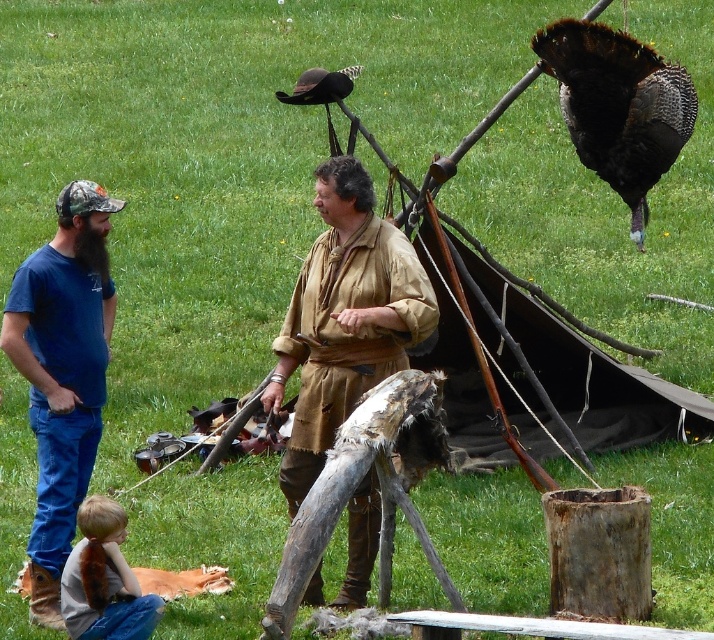
You are an observer looking at the scene. Which object, the brown leather shirt at center or the shiny black turkey at upper right, occupies more horizontal space in the image?

The shiny black turkey at upper right occupies more horizontal space because the brown leather shirt at center has a lesser width compared to it.

You are a photographer trying to capture a clear photo of the shiny black turkey at upper right. However, the blue denim jeans at left are blocking part of your view. Based on their sizes, which object should you move closer to the camera to ensure the turkey is fully visible?

The blue denim jeans at left is smaller in size compared to the shiny black turkey at upper right. To ensure the turkey is fully visible, you should move the blue denim jeans at left closer to the camera since its smaller size will take up less space in the frame, allowing the turkey to be centered and unobstructed.

You are standing at the camera position and want to place a 30 feet long rope between the blue denim jeans at left and the camera. Is the rope long enough?

The distance between the blue denim jeans at left and the camera is 33.12 feet, so the 30 feet long rope is not long enough to reach.